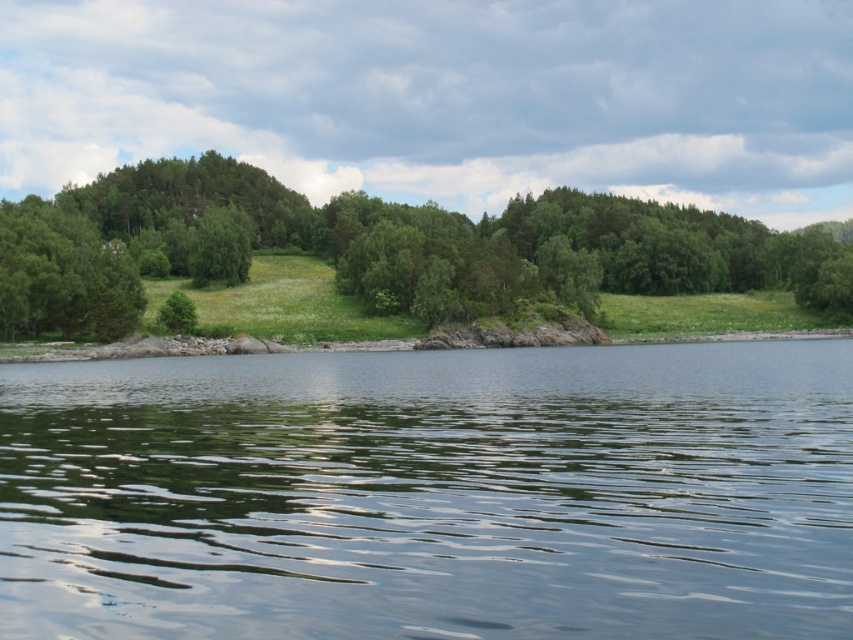
Which is more to the right, green reflective water at center or green leafy trees at center?

green leafy trees at center is more to the right.

Can you confirm if green reflective water at center is positioned to the left of green leafy trees at center?

Correct, you'll find green reflective water at center to the left of green leafy trees at center.

The height and width of the screenshot is (640, 853). Describe the element at coordinates (431, 493) in the screenshot. I see `green reflective water at center` at that location.

Locate an element on the screen. This screenshot has width=853, height=640. green reflective water at center is located at coordinates (431, 493).